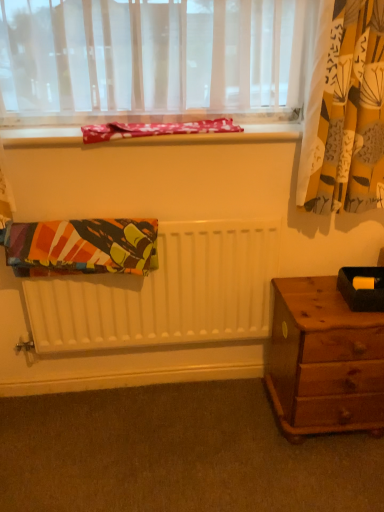
This screenshot has height=512, width=384. What are the coordinates of `free space to the left of wooden nightstand at lower right` in the screenshot? It's located at (231, 429).